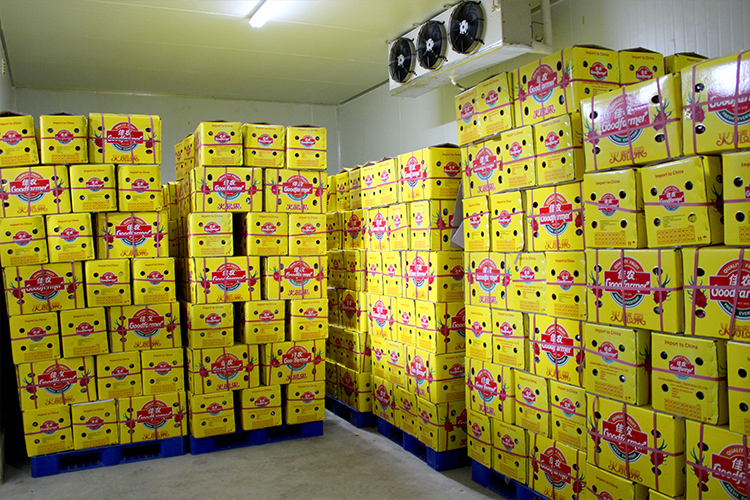
Locate an element on the screen. The height and width of the screenshot is (500, 750). wall is located at coordinates (382, 131).